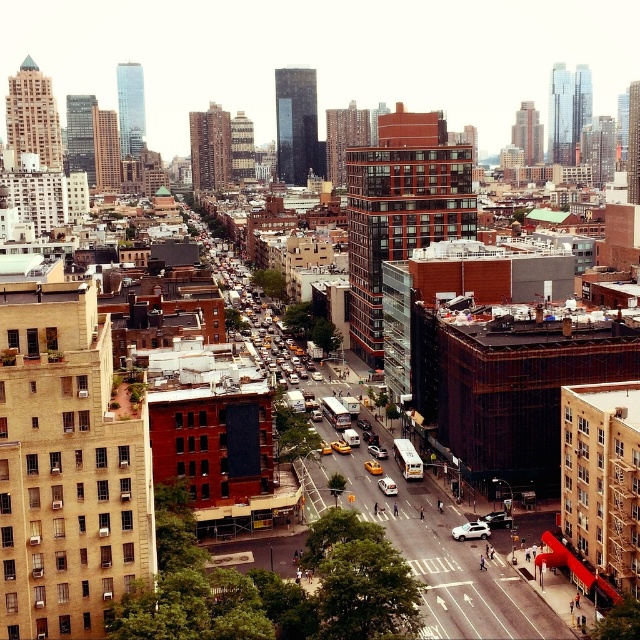
Describe the element at coordinates (470, 531) in the screenshot. The height and width of the screenshot is (640, 640). I see `white matte car at center` at that location.

Which is below, white matte car at center or white glossy car at center?

white matte car at center is lower down.

Who is more forward, (481, 525) or (387, 480)?

Positioned in front is point (481, 525).

At what (x,y) coordinates should I click in order to perform the action: click on white matte car at center. Please return your answer as a coordinate pair (x, y). Looking at the image, I should click on (x=470, y=531).